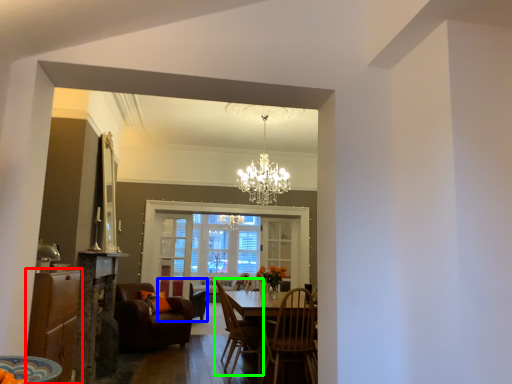
Question: Considering the real-world distances, which object is farthest from cabinetry (highlighted by a red box)? chair (highlighted by a blue box) or chair (highlighted by a green box)?

Choices:
 (A) chair
 (B) chair

Answer: (A)